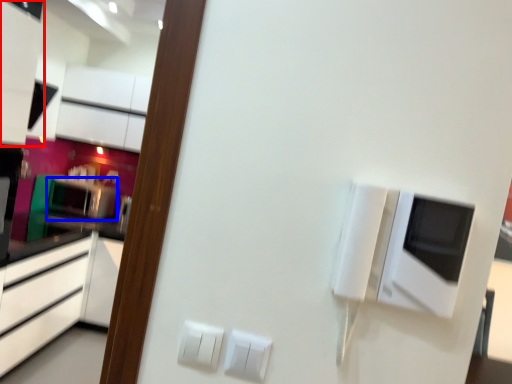
Question: Among these objects, which one is farthest to the camera, cabinetry (highlighted by a red box) or appliance (highlighted by a blue box)?

Choices:
 (A) cabinetry
 (B) appliance

Answer: (B)